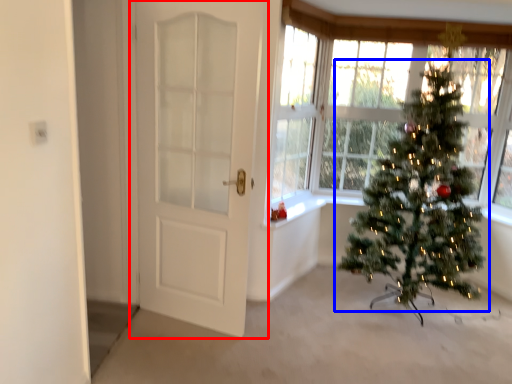
Question: Which point is further to the camera, door (highlighted by a red box) or christmas tree (highlighted by a blue box)?

Choices:
 (A) door
 (B) christmas tree

Answer: (B)